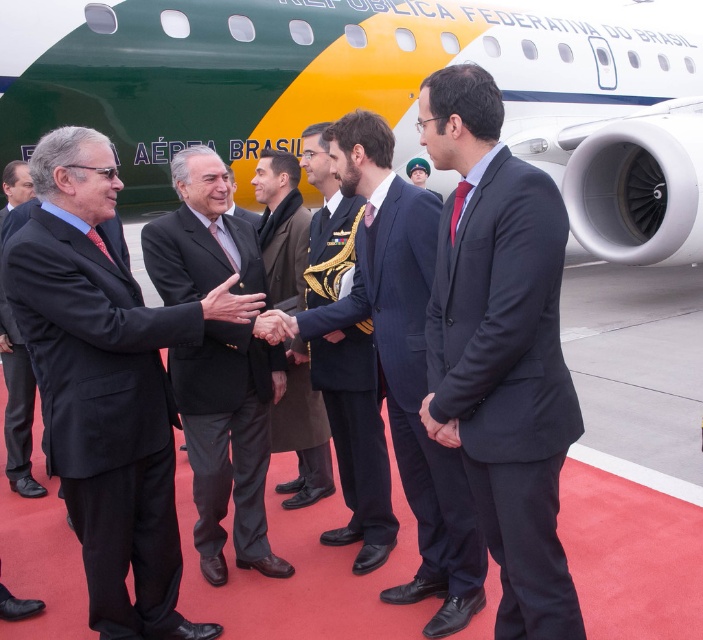
Question: Based on their relative distances, which object is nearer to the dark brown suit at center?

Choices:
 (A) matte black suit at left
 (B) red carpet at center

Answer: (A)

Question: Which point is farther from the camera taking this photo?

Choices:
 (A) (8, 552)
 (B) (557, 394)
 (C) (418, 512)

Answer: (A)

Question: Which object is closer to the camera taking this photo?

Choices:
 (A) brown wool coat at center
 (B) green matte airplane at upper center

Answer: (A)

Question: Is the position of dark gray suit at center less distant than that of brown wool coat at center?

Choices:
 (A) no
 (B) yes

Answer: (B)

Question: Can you confirm if dark gray suit at center is smaller than dark brown suit at center?

Choices:
 (A) yes
 (B) no

Answer: (B)

Question: Can you confirm if dark gray suit at center is smaller than dark blue wool suit at center?

Choices:
 (A) yes
 (B) no

Answer: (B)